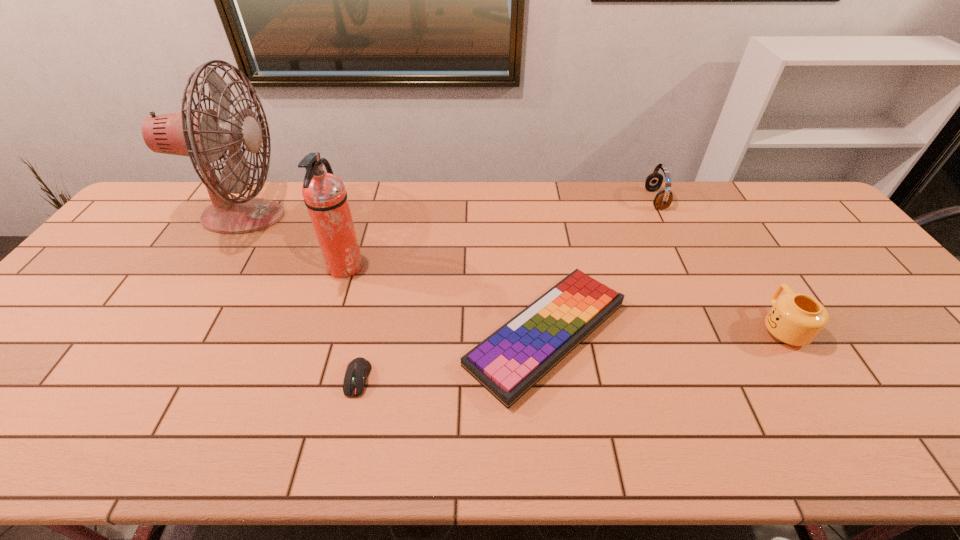
Where is `free location that satisfies the following two spatial constraints: 1. on the back side of the second shortest object; 2. at the nozzle of the fire extinguisher`? This screenshot has width=960, height=540. free location that satisfies the following two spatial constraints: 1. on the back side of the second shortest object; 2. at the nozzle of the fire extinguisher is located at coordinates (537, 267).